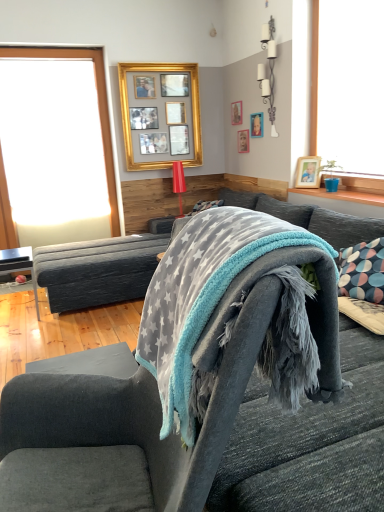
Where is `gray star-patterned towel at center`? The image size is (384, 512). gray star-patterned towel at center is located at coordinates (202, 294).

This screenshot has width=384, height=512. Find the location of `brushed metal table at lower left`. brushed metal table at lower left is located at coordinates tap(19, 265).

What do you see at coordinates (160, 115) in the screenshot? The height and width of the screenshot is (512, 384). I see `gold metallic picture frame at upper center, which is the first picture frame from left to right` at bounding box center [160, 115].

How much space does wooden picture frame at upper center, the 3th picture frame in the right-to-left sequence, occupy horizontally?

wooden picture frame at upper center, the 3th picture frame in the right-to-left sequence, is 0.74 inches wide.

At what (x,y) coordinates should I click in order to perform the action: click on velvet grey armchair at center. Please return your answer as a coordinate pair (x, y). Looking at the image, I should click on (160, 385).

Is gold metallic picture frame at upper center, the fifth picture frame positioned from the right, bigger than wooden picture frame at upper center, acting as the second picture frame starting from the left?

Yes, gold metallic picture frame at upper center, the fifth picture frame positioned from the right, is bigger than wooden picture frame at upper center, acting as the second picture frame starting from the left.

Is wooden picture frame at upper center, the 4th picture frame viewed from the right, located within gold metallic picture frame at upper center, the fifth picture frame positioned from the right?

No, wooden picture frame at upper center, the 4th picture frame viewed from the right, is not a part of gold metallic picture frame at upper center, the fifth picture frame positioned from the right.

From the picture: Are gold metallic picture frame at upper center, the fifth picture frame positioned from the right, and wooden picture frame at upper center, acting as the second picture frame starting from the left, far apart?

Actually, gold metallic picture frame at upper center, the fifth picture frame positioned from the right, and wooden picture frame at upper center, acting as the second picture frame starting from the left, are a little close together.

Is gold metallic picture frame at upper center, which is the first picture frame from left to right, wider or thinner than wooden picture frame at upper center, the 4th picture frame viewed from the right?

Clearly, gold metallic picture frame at upper center, which is the first picture frame from left to right, has more width compared to wooden picture frame at upper center, the 4th picture frame viewed from the right.

Would you consider velvet grey couch at center to be distant from wooden picture frame at upper center, the 3th picture frame in the right-to-left sequence?

Yes, velvet grey couch at center is far from wooden picture frame at upper center, the 3th picture frame in the right-to-left sequence.

Could you tell me if velvet grey couch at center is turned towards wooden picture frame at upper center, the 3th picture frame in the right-to-left sequence?

No, velvet grey couch at center is not oriented towards wooden picture frame at upper center, the 3th picture frame in the right-to-left sequence.

From a real-world perspective, between velvet grey couch at center and wooden picture frame at upper center, the 3th picture frame in the right-to-left sequence, who is vertically lower?

velvet grey couch at center is physically lower.

Image resolution: width=384 pixels, height=512 pixels. Find the location of `the 2nd picture frame above the velvet grey couch at center (from the image's perspective)`. the 2nd picture frame above the velvet grey couch at center (from the image's perspective) is located at coordinates (243, 141).

Is brushed metal table at lower left at the right side of gold metallic picture frame at upper center, the fifth picture frame positioned from the right?

No, brushed metal table at lower left is not to the right of gold metallic picture frame at upper center, the fifth picture frame positioned from the right.

Does brushed metal table at lower left have a greater height compared to gold metallic picture frame at upper center, the fifth picture frame positioned from the right?

No.

The width and height of the screenshot is (384, 512). I want to click on table that appears in front of the gold metallic picture frame at upper center, which is the first picture frame from left to right, so click(x=19, y=265).

How much distance is there between brushed metal table at lower left and gold metallic picture frame at upper center, which is the first picture frame from left to right?

brushed metal table at lower left is 6.38 feet away from gold metallic picture frame at upper center, which is the first picture frame from left to right.

How many degrees apart are the facing directions of wooden picture frame at upper right, which is the 5th picture frame in left-to-right order, and velvet grey couch at center?

wooden picture frame at upper right, which is the 5th picture frame in left-to-right order, and velvet grey couch at center are facing 28.4 degrees away from each other.

From the image's perspective, is wooden picture frame at upper right, which ranks as the 1th picture frame in right-to-left order, located above velvet grey couch at center?

Indeed, from the image's perspective, wooden picture frame at upper right, which ranks as the 1th picture frame in right-to-left order, is shown above velvet grey couch at center.

In terms of width, does wooden picture frame at upper right, which ranks as the 1th picture frame in right-to-left order, look wider or thinner when compared to velvet grey couch at center?

wooden picture frame at upper right, which ranks as the 1th picture frame in right-to-left order, is thinner than velvet grey couch at center.

Could you measure the distance between wooden picture frame at upper right, which is the 5th picture frame in left-to-right order, and velvet grey couch at center?

wooden picture frame at upper right, which is the 5th picture frame in left-to-right order, is 1.69 meters from velvet grey couch at center.

Considering the relative sizes of wooden picture frame at upper center, the 3th picture frame in the right-to-left sequence, and gray star-patterned towel at center in the image provided, is wooden picture frame at upper center, the 3th picture frame in the right-to-left sequence, shorter than gray star-patterned towel at center?

Indeed, wooden picture frame at upper center, the 3th picture frame in the right-to-left sequence, has a lesser height compared to gray star-patterned towel at center.

Considering the positions of objects wooden picture frame at upper center, marked as the third picture frame in a left-to-right arrangement, and gray star-patterned towel at center in the image provided, who is more to the right, wooden picture frame at upper center, marked as the third picture frame in a left-to-right arrangement, or gray star-patterned towel at center?

From the viewer's perspective, wooden picture frame at upper center, marked as the third picture frame in a left-to-right arrangement, appears more on the right side.

From the image's perspective, is wooden picture frame at upper center, marked as the third picture frame in a left-to-right arrangement, above or below gray star-patterned towel at center?

wooden picture frame at upper center, marked as the third picture frame in a left-to-right arrangement, is above gray star-patterned towel at center.

From a real-world perspective, is wooden picture frame at upper center, marked as the third picture frame in a left-to-right arrangement, on gray star-patterned towel at center?

Yes.

Between wooden picture frame at upper center, which is the 2th picture frame in right-to-left order, and brushed metal table at lower left, which one has more height?

brushed metal table at lower left is taller.

Is wooden picture frame at upper center, which is the 2th picture frame in right-to-left order, further to camera compared to brushed metal table at lower left?

Yes.

The width and height of the screenshot is (384, 512). I want to click on the 2nd picture frame behind the brushed metal table at lower left, so click(x=256, y=125).

How different are the orientations of wooden picture frame at upper center, which is the 2th picture frame in right-to-left order, and brushed metal table at lower left in degrees?

The angular difference between wooden picture frame at upper center, which is the 2th picture frame in right-to-left order, and brushed metal table at lower left is 89.9 degrees.

Considering the sizes of objects white glass window at left and gray star-patterned towel at center in the image provided, who is wider, white glass window at left or gray star-patterned towel at center?

Wider between the two is gray star-patterned towel at center.

Considering the sizes of white glass window at left and gray star-patterned towel at center in the image, is white glass window at left taller or shorter than gray star-patterned towel at center?

white glass window at left is taller than gray star-patterned towel at center.

Does white glass window at left appear on the left side of gray star-patterned towel at center?

Yes, white glass window at left is to the left of gray star-patterned towel at center.

Is gray star-patterned towel at center at the back of white glass window at left?

No.

Locate an element on the screen. Image resolution: width=384 pixels, height=512 pixels. the 2nd picture frame behind when counting from the gold metallic picture frame at upper center, the fifth picture frame positioned from the right is located at coordinates (236, 113).

Locate an element on the screen. This screenshot has width=384, height=512. the 3rd picture frame to the right of the velvet grey couch at center, counting from the anchor's position is located at coordinates (243, 141).

Based on their spatial positions, is wooden picture frame at upper center, marked as the third picture frame in a left-to-right arrangement, or white glass window at left closer to gold metallic picture frame at upper center, the fifth picture frame positioned from the right?

Among the two, white glass window at left is located nearer to gold metallic picture frame at upper center, the fifth picture frame positioned from the right.

From the image, which object appears to be nearer to gray star-patterned towel at center, wooden picture frame at upper right, which is the 5th picture frame in left-to-right order, or wooden picture frame at upper center, the 4th picture frame viewed from the right?

The object closer to gray star-patterned towel at center is wooden picture frame at upper right, which is the 5th picture frame in left-to-right order.

Considering their positions, is wooden picture frame at upper center, marked as the third picture frame in a left-to-right arrangement, positioned further to gray star-patterned towel at center than wooden picture frame at upper center, the fourth picture frame when ordered from left to right?

The object further to gray star-patterned towel at center is wooden picture frame at upper center, marked as the third picture frame in a left-to-right arrangement.

Estimate the real-world distances between objects in this image. Which object is closer to gold metallic picture frame at upper center, the fifth picture frame positioned from the right, white glass window at left or wooden picture frame at upper right, which ranks as the 1th picture frame in right-to-left order?

white glass window at left is positioned closer to the anchor gold metallic picture frame at upper center, the fifth picture frame positioned from the right.

Estimate the real-world distances between objects in this image. Which object is further from brushed metal table at lower left, wooden picture frame at upper center, the 4th picture frame viewed from the right, or white glass window at left?

wooden picture frame at upper center, the 4th picture frame viewed from the right, is further to brushed metal table at lower left.

Considering their positions, is velvet grey couch at center positioned further to gray star-patterned towel at center than velvet grey armchair at center?

velvet grey couch at center.

From the image, which object appears to be nearer to white glass window at left, brushed metal table at lower left or wooden picture frame at upper center, which is the 2th picture frame in right-to-left order?

Among the two, brushed metal table at lower left is located nearer to white glass window at left.

From the image, which object appears to be farther from gold metallic picture frame at upper center, which is the first picture frame from left to right, white glass window at left or velvet grey couch at center?

velvet grey couch at center is further to gold metallic picture frame at upper center, which is the first picture frame from left to right.

At what (x,y) coordinates should I click in order to perform the action: click on couch between white glass window at left and brushed metal table at lower left from top to bottom. Please return your answer as a coordinate pair (x, y). Looking at the image, I should click on click(99, 270).

Where is `bath towel positioned between velvet grey armchair at center and velvet grey couch at center from near to far`? This screenshot has width=384, height=512. bath towel positioned between velvet grey armchair at center and velvet grey couch at center from near to far is located at coordinates (202, 294).

This screenshot has width=384, height=512. I want to click on table located between gray star-patterned towel at center and gold metallic picture frame at upper center, the fifth picture frame positioned from the right, in the depth direction, so click(x=19, y=265).

The height and width of the screenshot is (512, 384). I want to click on table positioned between velvet grey armchair at center and white glass window at left from near to far, so click(19, 265).